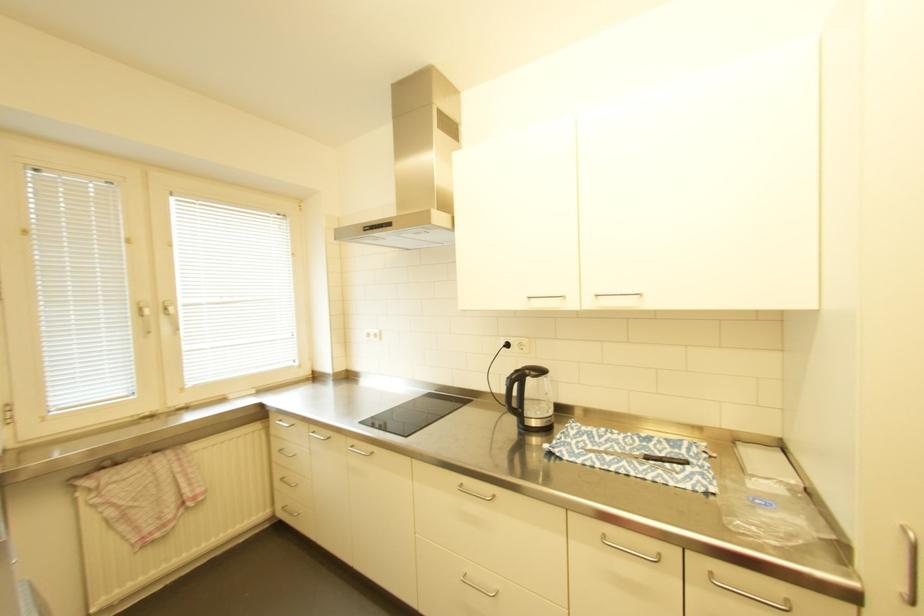
Where is `black kettle handle`? The width and height of the screenshot is (924, 616). black kettle handle is located at coordinates (514, 392).